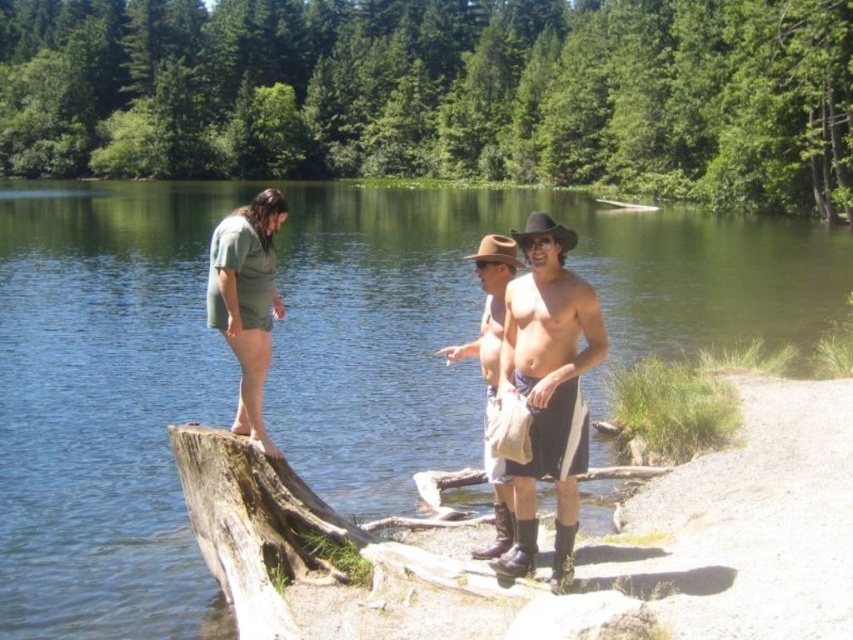
Is brown rough wood log at lower center to the left of green matte shorts at left from the viewer's perspective?

No, brown rough wood log at lower center is not to the left of green matte shorts at left.

Who is lower down, brown rough wood log at lower center or green matte shorts at left?

brown rough wood log at lower center is lower down.

This screenshot has width=853, height=640. I want to click on brown rough wood log at lower center, so click(357, 564).

Who is higher up, shiny metallic shorts at center or brown leather cowboy boots at center?

brown leather cowboy boots at center is higher up.

Does shiny metallic shorts at center have a lesser width compared to brown leather cowboy boots at center?

Indeed, shiny metallic shorts at center has a lesser width compared to brown leather cowboy boots at center.

At what (x,y) coordinates should I click in order to perform the action: click on shiny metallic shorts at center. Please return your answer as a coordinate pair (x, y). The height and width of the screenshot is (640, 853). Looking at the image, I should click on (548, 387).

Can you confirm if brown rough wood at lower left is thinner than brown leather cowboy boots at center?

Incorrect, brown rough wood at lower left's width is not less than brown leather cowboy boots at center's.

Is brown rough wood at lower left to the left of brown leather cowboy boots at center from the viewer's perspective?

Indeed, brown rough wood at lower left is positioned on the left side of brown leather cowboy boots at center.

Does point (341, 522) lie in front of point (482, 269)?

Yes, point (341, 522) is in front of point (482, 269).

Identify the location of brown rough wood at lower left. (260, 529).